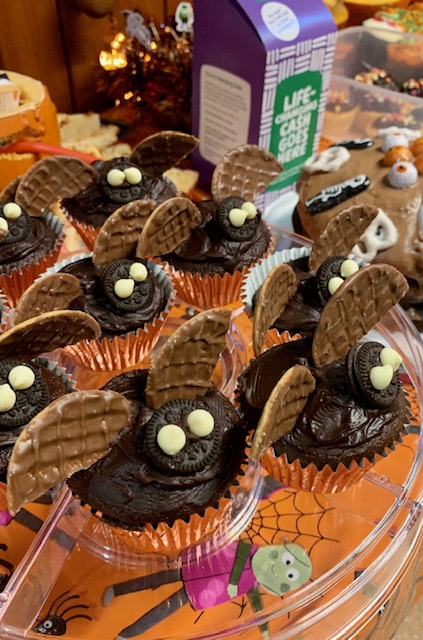
Locate an element on the screen. The width and height of the screenshot is (423, 640). plastic bin is located at coordinates (351, 54).